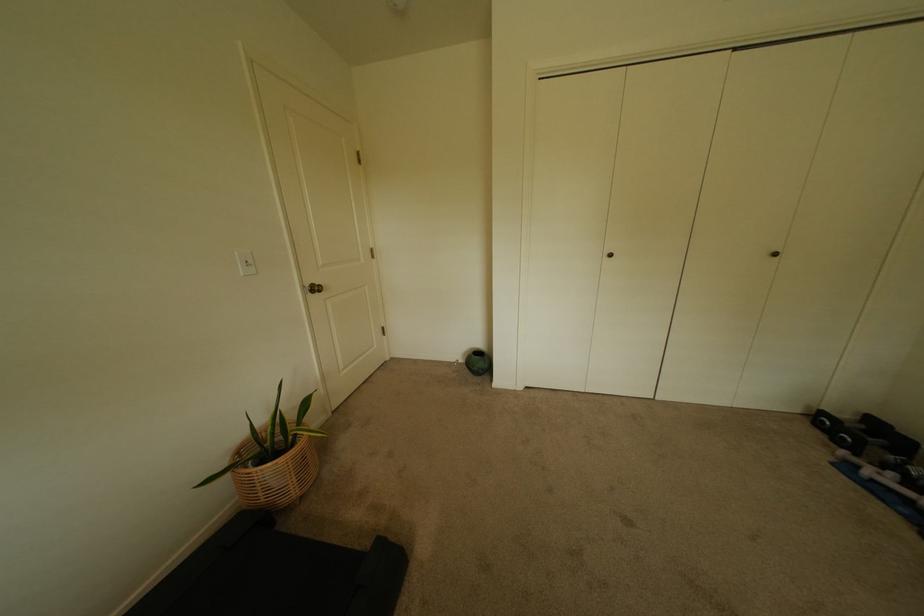
Locate an element on the screen. gold doorknob is located at coordinates (313, 288).